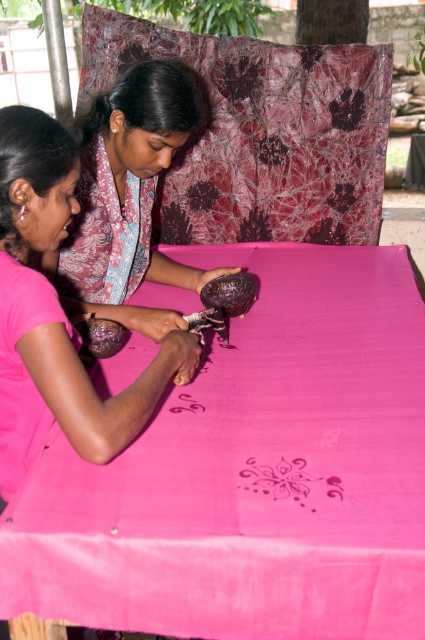
Question: Is pink matte shirt at lower left to the left of matte purple bowl at upper center from the viewer's perspective?

Choices:
 (A) yes
 (B) no

Answer: (A)

Question: Which point is closer to the camera?

Choices:
 (A) pink fabric at center
 (B) pink silk scarf at upper left
 (C) matte purple bowl at upper center
 (D) pink matte fabric at center

Answer: (A)

Question: Which is farther from the pink fabric at center?

Choices:
 (A) pink matte shirt at lower left
 (B) pink silk scarf at upper left
 (C) pink fabric at lower left

Answer: (B)

Question: Can you confirm if pink matte shirt at lower left is wider than pink silk scarf at upper left?

Choices:
 (A) yes
 (B) no

Answer: (A)

Question: Which point is farther to the camera?

Choices:
 (A) (127, 205)
 (B) (289, 497)
 (C) (11, 332)
 (D) (141, 125)

Answer: (A)

Question: In this image, where is pink fabric at center located relative to pink fabric at lower left?

Choices:
 (A) below
 (B) above

Answer: (B)